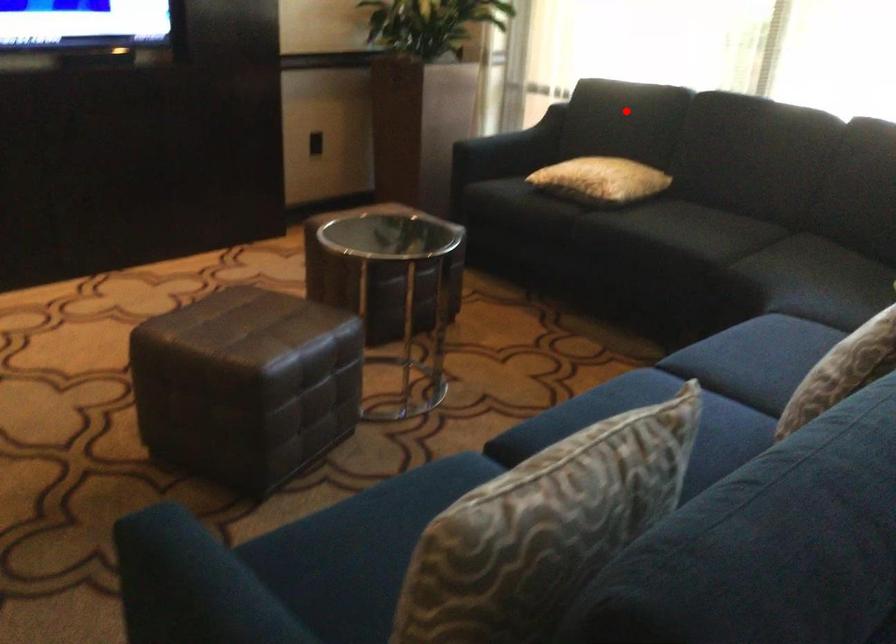
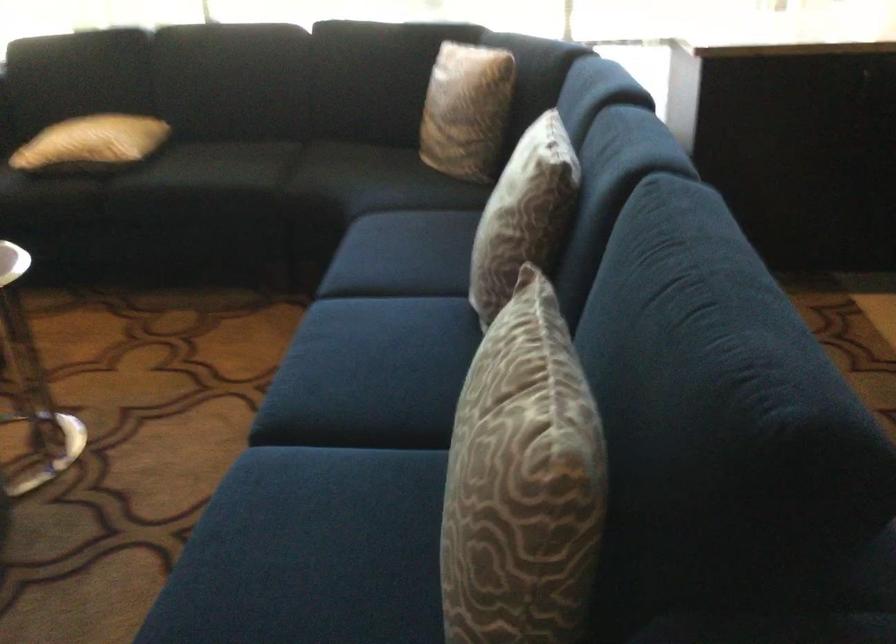
Where in the second image is the point corresponding to the highlighted location from the first image?

(82, 64)